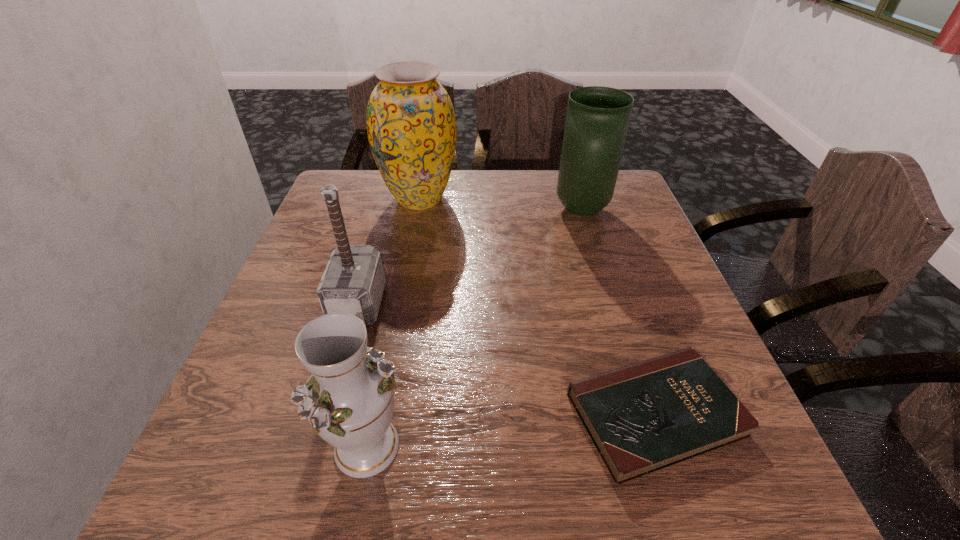
I want to click on blank area at the right edge, so click(x=652, y=316).

Identify the location of vacant space at the far left corner. (364, 173).

Locate an element on the screen. The height and width of the screenshot is (540, 960). free space at the near left corner is located at coordinates (222, 511).

Find the location of a particular element. The height and width of the screenshot is (540, 960). free region at the far right corner of the desktop is located at coordinates (634, 213).

Where is `vacant space that's between the hammer and the shortest object`? vacant space that's between the hammer and the shortest object is located at coordinates (507, 359).

Where is `free point between the Bible and the rightmost vase`? free point between the Bible and the rightmost vase is located at coordinates (618, 312).

Identify which object is the third nearest to the shortest object. Please provide its 2D coordinates. Your answer should be formatted as a tuple, i.e. [(x, y)], where the tuple contains the x and y coordinates of a point satisfying the conditions above.

[(597, 119)]

Select which object is the second closest to the shortest object. Please provide its 2D coordinates. Your answer should be formatted as a tuple, i.e. [(x, y)], where the tuple contains the x and y coordinates of a point satisfying the conditions above.

[(353, 282)]

The height and width of the screenshot is (540, 960). What are the coordinates of `vase that is the second closest to the rightmost vase` in the screenshot? It's located at (349, 399).

Locate an element on the screen. This screenshot has width=960, height=540. the closest vase to the shortest vase is located at coordinates (411, 125).